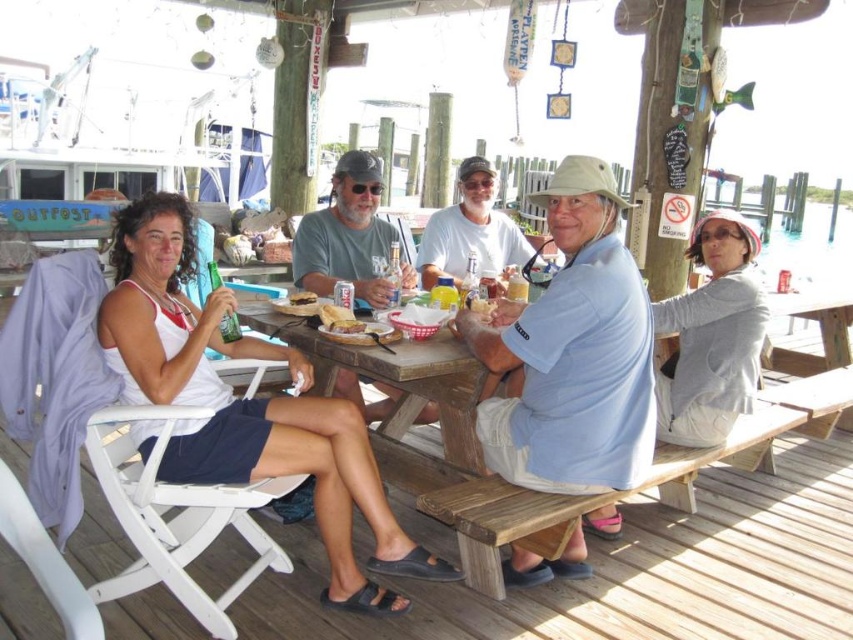
You are sitting on the wooden bench at lower center and want to reach the slightly toasted bread at center. Is the bread within easy arm reach?

The wooden bench at lower center is closer to the viewer than the slightly toasted bread at center, so the bread is farther away. It might not be within easy arm reach from the bench.

You are a photographer trying to capture a closeup shot of the brown bread at center. You notice the white cotton shirt at center is blocking your view. Based on their positions, can you determine if you can move the shirt to the left to get a clear shot of the bread?

The white cotton shirt at center is positioned on the right side of brown bread at center, so moving it to the left would place it closer to the bread. However, since the shirt is already on the right, moving it left might not fully clear the view unless there is enough space. The description only states their relative positions, not the distance between them, so it is uncertain if moving the shirt left would fully expose the bread.

What is located at the coordinates point [471,232]?

At point [471,232] lies white cotton shirt at center.